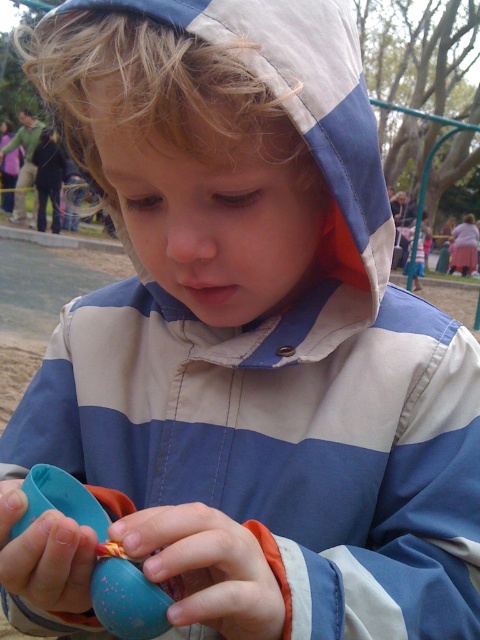
Question: Which object is farther from the camera taking this photo?

Choices:
 (A) blue rubber toy at center
 (B) matte plastic egg at center

Answer: (B)

Question: Is blue rubber toy at center to the left of matte plastic egg at center from the viewer's perspective?

Choices:
 (A) no
 (B) yes

Answer: (A)

Question: Can you confirm if blue rubber toy at center is thinner than matte plastic egg at center?

Choices:
 (A) no
 (B) yes

Answer: (B)

Question: Can you confirm if blue rubber toy at center is bigger than matte plastic egg at center?

Choices:
 (A) yes
 (B) no

Answer: (B)

Question: Among these objects, which one is farthest from the camera?

Choices:
 (A) blue rubber toy at center
 (B) matte plastic egg at center

Answer: (B)